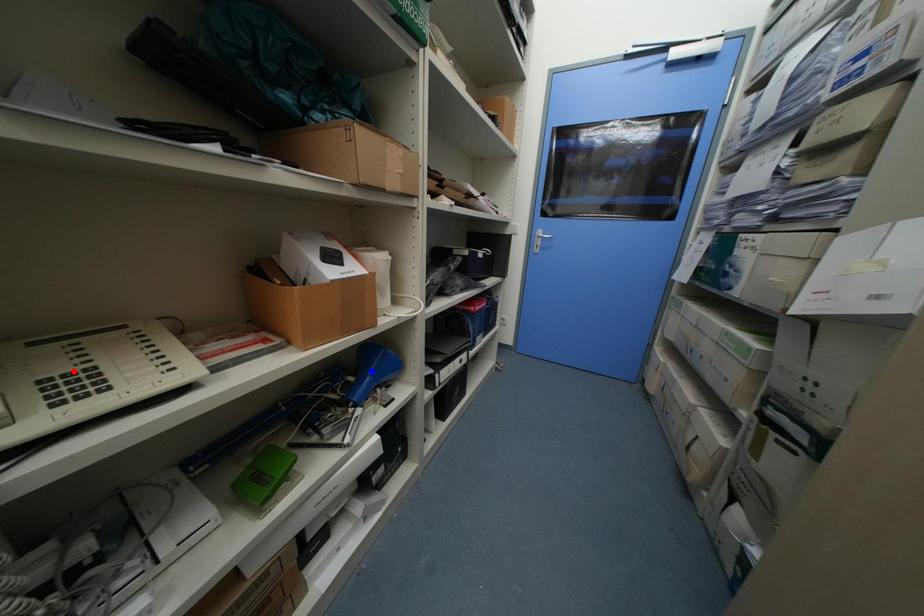
Question: Two points are marked on the image. Which point is closer to the camera?

Choices:
 (A) Blue point is closer.
 (B) Red point is closer.

Answer: (B)